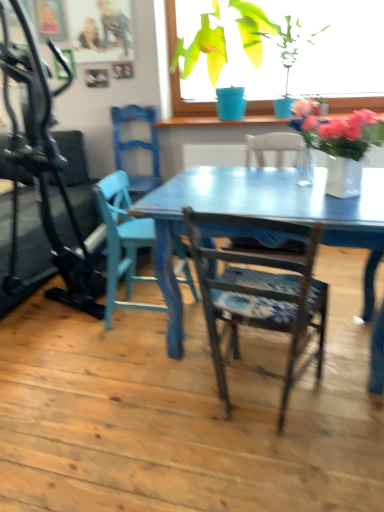
Question: In terms of height, does matte blue chair at left, the first chair viewed from the back, look taller or shorter compared to green matte plant pot at upper center, the second houseplant viewed from the right?

Choices:
 (A) tall
 (B) short

Answer: (B)

Question: Considering the positions of point (119, 113) and point (246, 8), is point (119, 113) closer or farther from the camera than point (246, 8)?

Choices:
 (A) closer
 (B) farther

Answer: (B)

Question: Based on their relative distances, which object is farther from the green glossy plant at upper center, which is counted as the first houseplant, starting from the right?

Choices:
 (A) matte blue chair at center, the second chair from the front
 (B) pink matte vase at upper center, the 1th flower in the right-to-left sequence
 (C) green matte plant pot at upper center, the 1th houseplant from the left
 (D) white glossy vase at upper right, which ranks as the 1th flower in left-to-right order
 (E) matte blue chair at left, the 3th chair viewed from the front

Answer: (A)

Question: Which of these objects is positioned closest to the black rubber treadmill at left?

Choices:
 (A) pink matte vase at upper center, the 1th flower in the right-to-left sequence
 (B) matte blue chair at left, the 3th chair viewed from the front
 (C) green glossy plant at upper center, which is counted as the first houseplant, starting from the right
 (D) white glossy vase at upper right, the second flower from the top
 (E) green matte plant pot at upper center, the 1th houseplant from the left

Answer: (B)